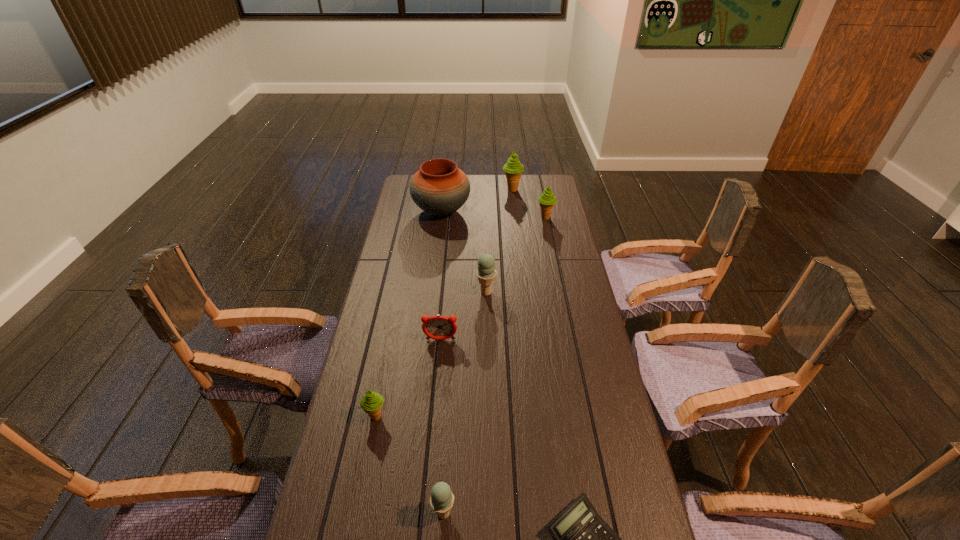
The height and width of the screenshot is (540, 960). In order to click on pottery in this screenshot , I will do `click(440, 188)`.

Where is `the tallest ice cream`? Image resolution: width=960 pixels, height=540 pixels. the tallest ice cream is located at coordinates (513, 169).

Locate an element on the screen. the farthest green icecream is located at coordinates (513, 169).

At what (x,y) coordinates should I click in order to perform the action: click on the rightmost ice cream. Please return your answer as a coordinate pair (x, y). The width and height of the screenshot is (960, 540). Looking at the image, I should click on 547,200.

The width and height of the screenshot is (960, 540). In order to click on the second smallest green icecream in this screenshot , I will do `click(547, 200)`.

The width and height of the screenshot is (960, 540). What are the coordinates of `the right blue ice cream` in the screenshot? It's located at (486, 272).

This screenshot has width=960, height=540. I want to click on the bigger blue ice cream, so click(486, 272).

Image resolution: width=960 pixels, height=540 pixels. Find the location of `the leftmost green icecream`. the leftmost green icecream is located at coordinates (371, 403).

This screenshot has width=960, height=540. I want to click on the leftmost ice cream, so click(x=371, y=403).

The width and height of the screenshot is (960, 540). I want to click on the fourth ice cream from right to left, so click(442, 499).